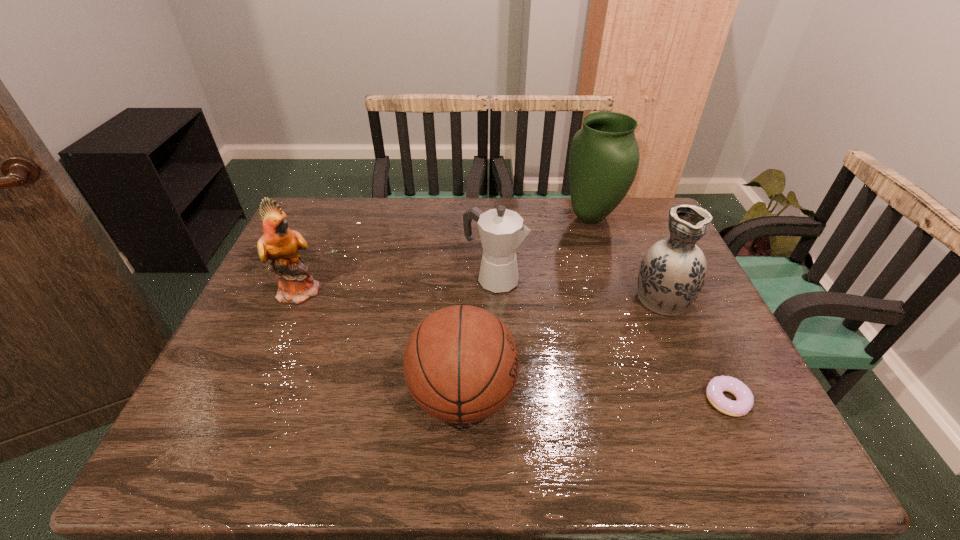
The width and height of the screenshot is (960, 540). In order to click on the taller vase in this screenshot , I will do `click(604, 155)`.

Where is `the farthest object`? the farthest object is located at coordinates (604, 155).

The width and height of the screenshot is (960, 540). Find the location of `parrot`. parrot is located at coordinates (280, 244).

Locate an element on the screen. This screenshot has width=960, height=540. the shorter vase is located at coordinates (672, 272).

The width and height of the screenshot is (960, 540). I want to click on coffeepot, so click(x=502, y=231).

Identify the location of basketball. (461, 364).

Image resolution: width=960 pixels, height=540 pixels. Find the location of `doughnut`. doughnut is located at coordinates click(x=744, y=402).

Identify the location of free space located 0.250m on the left of the farthest object. (490, 217).

Locate an element on the screen. This screenshot has width=960, height=540. free space located on the front-facing side of the parrot is located at coordinates (x=424, y=290).

Locate an element on the screen. vacant point located 0.160m with the handle on the side of the nearer vase is located at coordinates (637, 242).